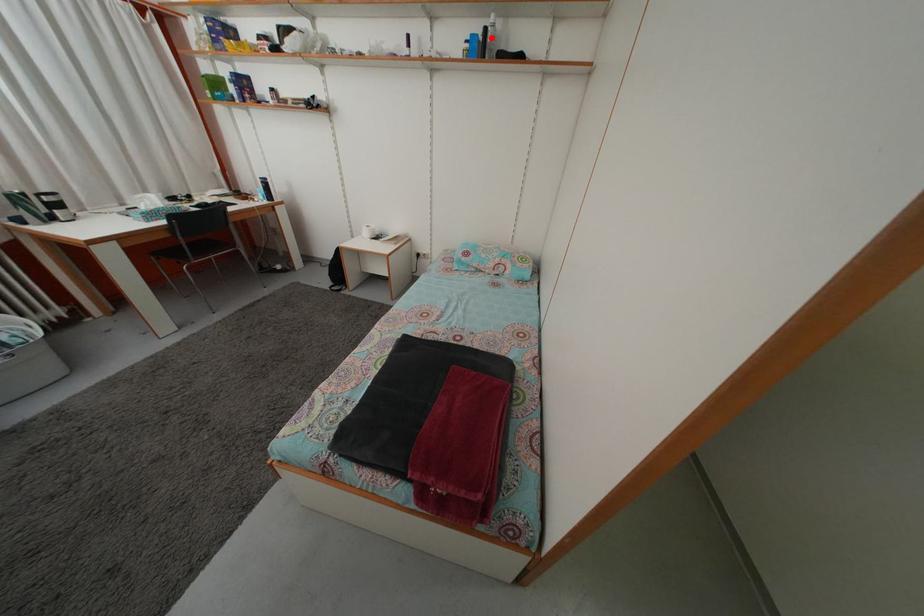
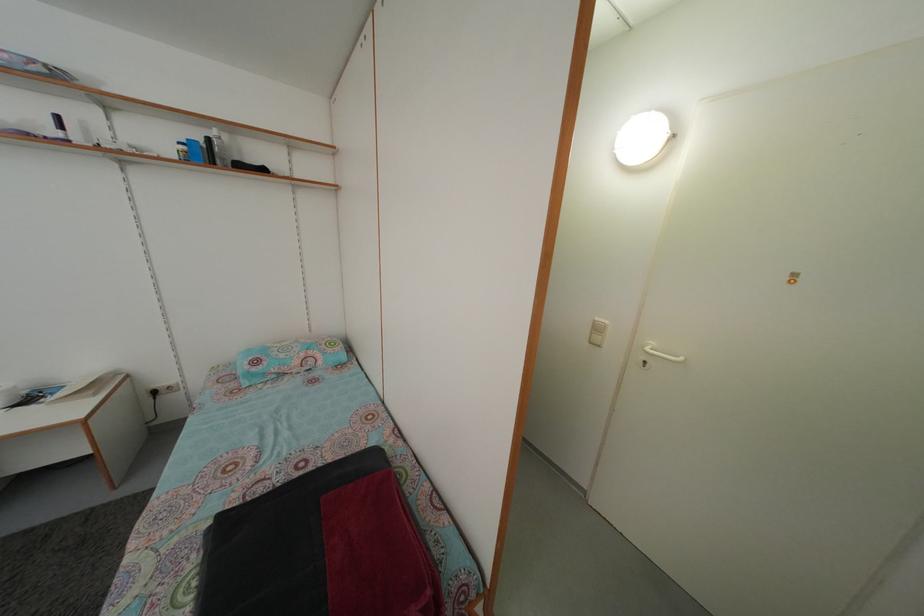
Question: I am providing you with two images of the same scene from different viewpoints. A red point is marked on the first image. Can you still see the location of the red point in image 2?

Choices:
 (A) Yes
 (B) No

Answer: (A)